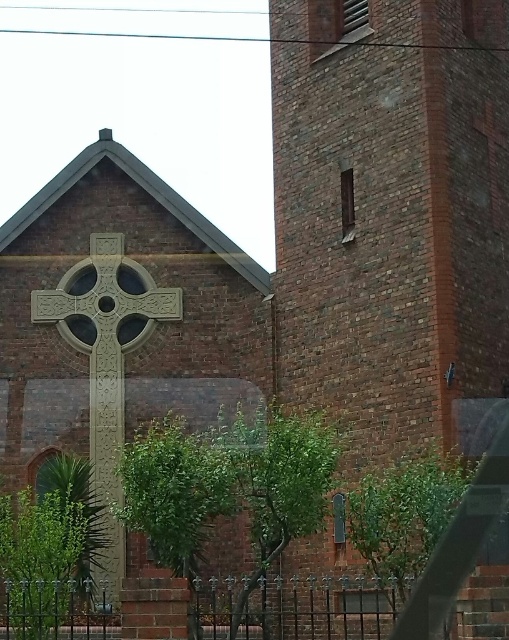
You are a photographer planning to take a photo of the brick tower at center and the carved stone cross at center. If you want to ensure both are in focus, which object should you position closer to the camera to maintain depth of field?

The brick tower at center is bigger than the carved stone cross at center, so positioning the brick tower at center closer to the camera will help maintain depth of field as larger objects require less adjustment for focus.